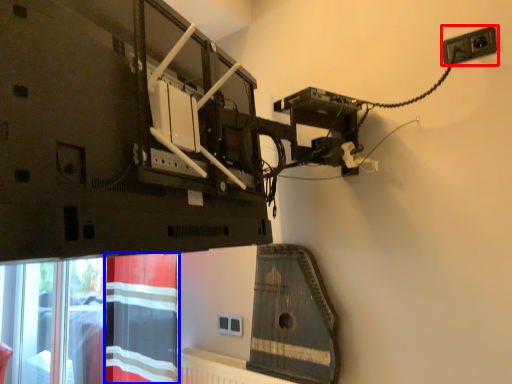
Question: Which point is closer to the camera, power plugs and sockets (highlighted by a red box) or curtain (highlighted by a blue box)?

Choices:
 (A) power plugs and sockets
 (B) curtain

Answer: (A)